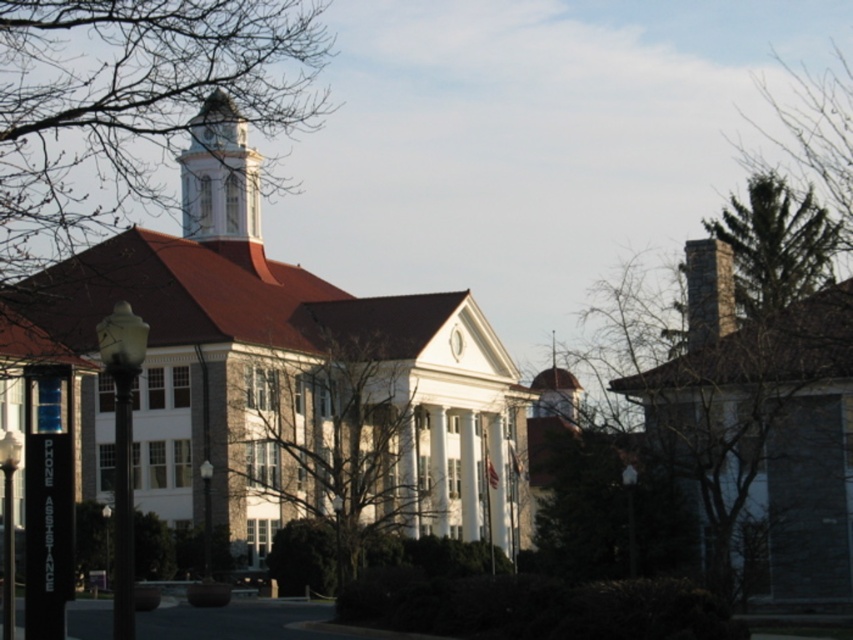
Between point (247, 360) and point (213, 170), which one is positioned in front?

Point (247, 360)

Which of these two, bare branches at center or white stone clock tower at upper center, stands taller?

With more height is bare branches at center.

Does point (337, 506) come closer to viewer compared to point (218, 221)?

Yes, it is in front of point (218, 221).

I want to click on bare branches at center, so click(x=334, y=440).

In the scene shown: Does white stone church at center have a lesser height compared to green textured tree at upper right?

In fact, white stone church at center may be taller than green textured tree at upper right.

Is point (357, 304) positioned behind point (831, 276)?

Yes, point (357, 304) is behind point (831, 276).

The height and width of the screenshot is (640, 853). Identify the location of white stone church at center. (292, 372).

Consider the image. Between bare branches at center and green textured tree at upper right, which one has more height?

With more height is bare branches at center.

Does bare branches at center have a lesser height compared to green textured tree at upper right?

In fact, bare branches at center may be taller than green textured tree at upper right.

The image size is (853, 640). What are the coordinates of `bare branches at center` in the screenshot? It's located at (334, 440).